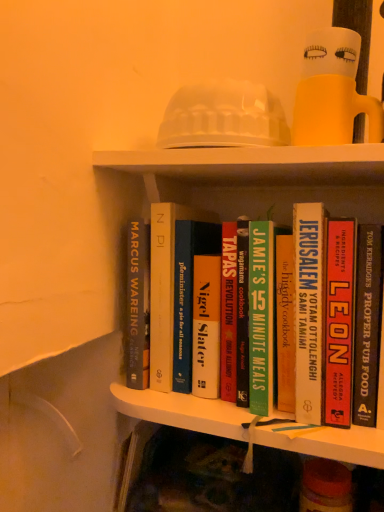
Question: In which direction should I rotate to look at hardcover cookbook at center, arranged as the 3th book when viewed from the right?

Choices:
 (A) right
 (B) left

Answer: (A)

Question: From the image's perspective, does black hardcover book at right, the 5th book from the left, appear lower than hardcover book at center, the first book when ordered from left to right?

Choices:
 (A) yes
 (B) no

Answer: (A)

Question: Is the position of black hardcover book at right, the 5th book from the left, less distant than that of hardcover book at center, the first book when ordered from left to right?

Choices:
 (A) yes
 (B) no

Answer: (A)

Question: Is black hardcover book at right, the 5th book from the left, outside hardcover book at center, the first book when ordered from left to right?

Choices:
 (A) yes
 (B) no

Answer: (A)

Question: From the image's perspective, does black hardcover book at right, the first book when ordered from right to left, appear higher than hardcover book at center, the first book when ordered from left to right?

Choices:
 (A) no
 (B) yes

Answer: (A)

Question: Can you confirm if black hardcover book at right, the first book when ordered from right to left, is positioned to the left of hardcover book at center, which is counted as the 5th book, starting from the right?

Choices:
 (A) yes
 (B) no

Answer: (B)

Question: Does black hardcover book at right, the first book when ordered from right to left, have a lesser height compared to hardcover book at center, the first book when ordered from left to right?

Choices:
 (A) no
 (B) yes

Answer: (B)

Question: Is green matte book at center, acting as the fourth book starting from the right, completely or partially outside of hardcover book at center, the first book when ordered from left to right?

Choices:
 (A) yes
 (B) no

Answer: (A)

Question: Is green matte book at center, acting as the fourth book starting from the right, in front of hardcover book at center, the first book when ordered from left to right?

Choices:
 (A) yes
 (B) no

Answer: (A)

Question: From a real-world perspective, does green matte book at center, acting as the fourth book starting from the right, stand above hardcover book at center, the first book when ordered from left to right?

Choices:
 (A) no
 (B) yes

Answer: (A)

Question: Considering the relative positions of green matte book at center, acting as the fourth book starting from the right, and hardcover book at center, the first book when ordered from left to right, in the image provided, is green matte book at center, acting as the fourth book starting from the right, to the left of hardcover book at center, the first book when ordered from left to right, from the viewer's perspective?

Choices:
 (A) yes
 (B) no

Answer: (B)

Question: Is green matte book at center, the second book positioned from the left, oriented away from hardcover book at center, which is counted as the 5th book, starting from the right?

Choices:
 (A) yes
 (B) no

Answer: (B)

Question: Considering the relative positions of green matte book at center, the second book positioned from the left, and hardcover book at center, the first book when ordered from left to right, in the image provided, is green matte book at center, the second book positioned from the left, behind hardcover book at center, the first book when ordered from left to right,?

Choices:
 (A) no
 (B) yes

Answer: (A)

Question: Does translucent plastic doll at upper center have a greater width compared to green matte book at center, acting as the fourth book starting from the right?

Choices:
 (A) no
 (B) yes

Answer: (A)